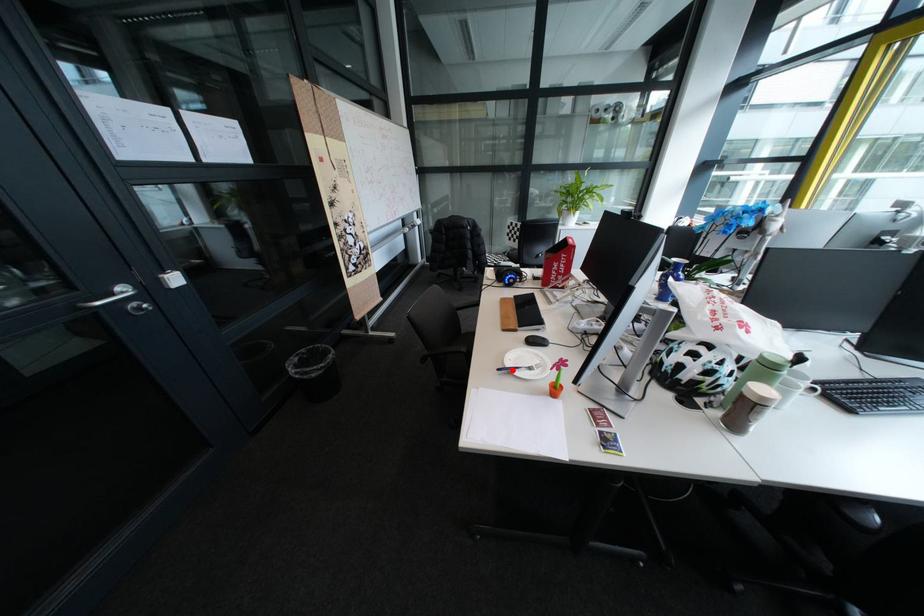
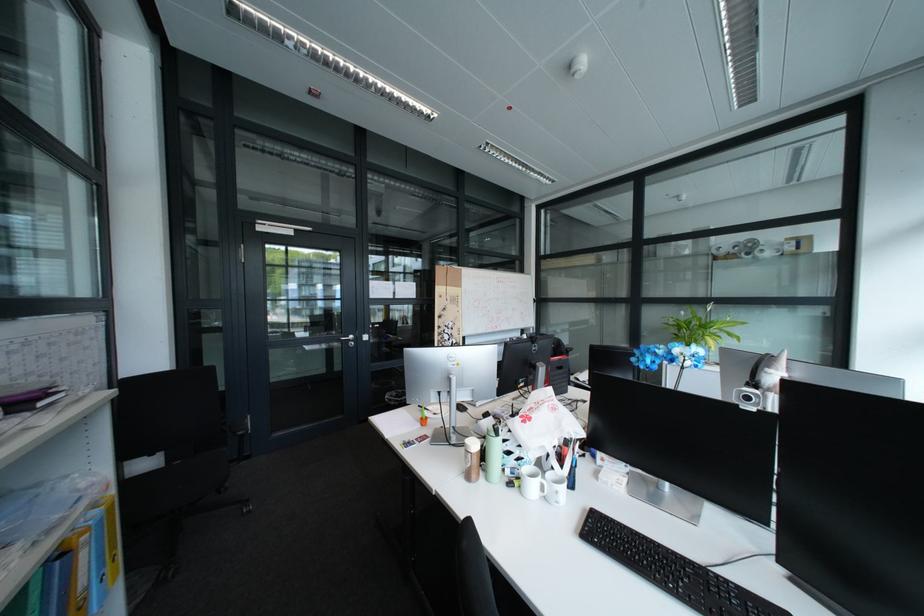
Question: I am providing you with two images of the same scene from different viewpoints. A red point is marked on the first image. Can you still see the location of the red point in image 2?

Choices:
 (A) Yes
 (B) No

Answer: (B)